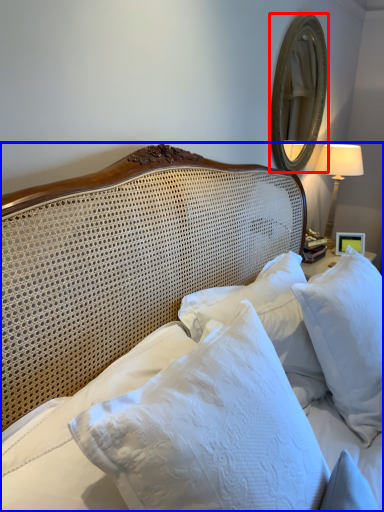
Question: Which object is closer to the camera taking this photo, mirror (highlighted by a red box) or bed (highlighted by a blue box)?

Choices:
 (A) mirror
 (B) bed

Answer: (B)